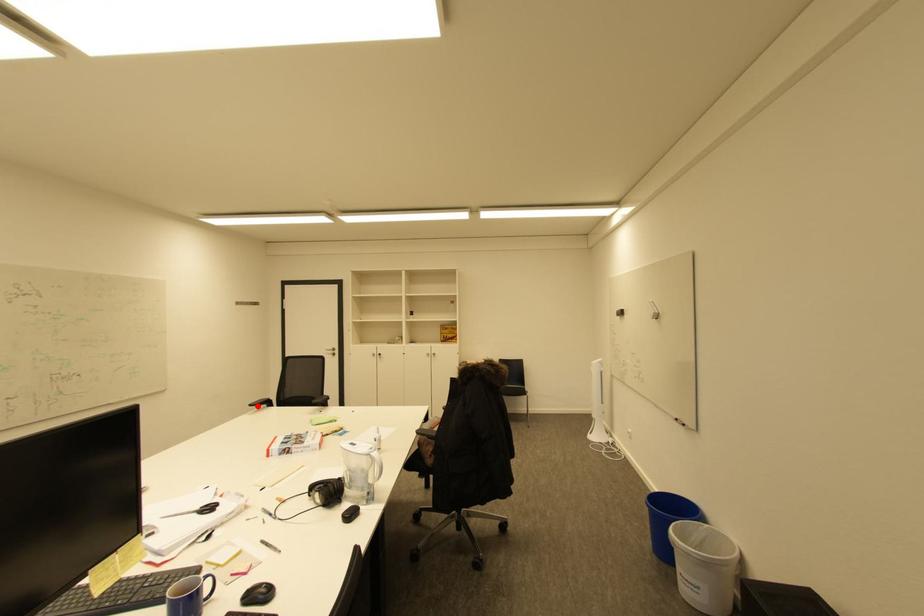
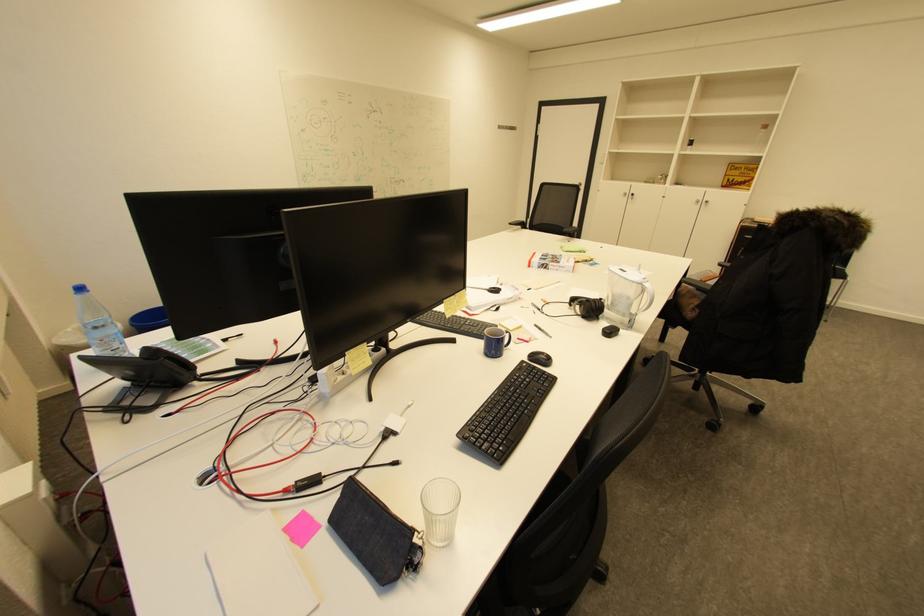
Where in the second image is the point corresponding to the highlighted location from the first image?

(517, 225)